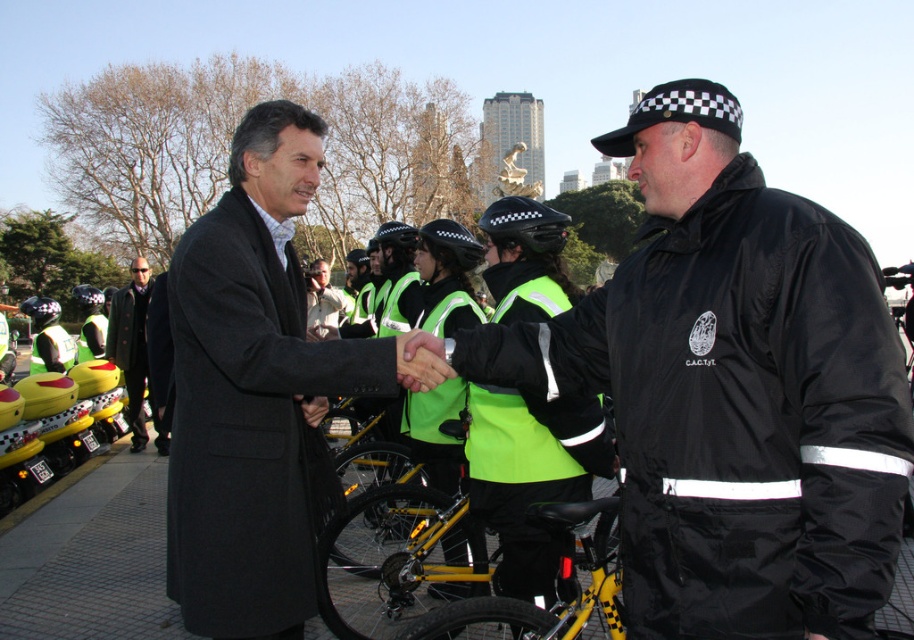
You are a photographer standing at the camera position. You want to take a closeup of the black glossy jacket at center. Given that your camera has a maximum zoom range of 20 meters, can you capture the jacket in focus?

The black glossy jacket at center is 18.94 meters away from camera, which is within the maximum zoom range of 20 meters. Therefore, you can capture the jacket in focus.

You are a photographer standing at the center of the scene. You want to take a photo that includes both the point at coordinates point (243, 422) and point (485, 620). Which point should you focus on first to ensure both are in clear view?

You should focus on point (243, 422) first because it is closer to the camera than point (485, 620), ensuring both points are in clear view.

You are a photographer positioned to the side of the scene. You need to capture a photo where both the matte black coat at center and the yellow metallic bicycle at center are visible. Based on their heights, which object should be placed closer to the camera to ensure both are fully visible in the frame?

The matte black coat at center is taller than the yellow metallic bicycle at center. To ensure both are fully visible in the frame, the yellow metallic bicycle at center should be placed closer to the camera so that the taller matte black coat at center doesn t block its view.